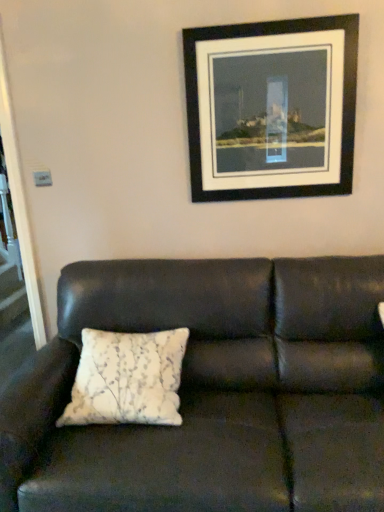
What do you see at coordinates (271, 108) in the screenshot?
I see `black matte picture frame at upper center` at bounding box center [271, 108].

Identify the location of white textured pillow at center. This screenshot has height=512, width=384. (127, 379).

Which object is positioned more to the left, leather couch at center or black matte picture frame at upper center?

leather couch at center.

Measure the distance between leather couch at center and black matte picture frame at upper center.

31.42 inches.

Which point is more forward, (264, 267) or (222, 117)?

The point (264, 267) is closer to the camera.

Is white textured pillow at center in front of black matte picture frame at upper center?

Yes, it is in front of black matte picture frame at upper center.

Is white textured pillow at center next to black matte picture frame at upper center and touching it?

white textured pillow at center is not next to black matte picture frame at upper center, and they're not touching.

Is white textured pillow at center turned away from black matte picture frame at upper center?

No.

Can you confirm if white textured pillow at center is wider than black matte picture frame at upper center?

Correct, the width of white textured pillow at center exceeds that of black matte picture frame at upper center.

Is black matte picture frame at upper center inside the boundaries of white textured pillow at center, or outside?

black matte picture frame at upper center is outside white textured pillow at center.

Which object is closer to the camera, black matte picture frame at upper center or white textured pillow at center?

white textured pillow at center is in front.

There is a white textured pillow at center. Where is `picture frame above it (from a real-world perspective)`? This screenshot has width=384, height=512. picture frame above it (from a real-world perspective) is located at coordinates (271, 108).

From a real-world perspective, is black matte picture frame at upper center located beneath white textured pillow at center?

Incorrect, from a real-world perspective, black matte picture frame at upper center is higher than white textured pillow at center.

In the scene shown: From a real-world perspective, is black matte picture frame at upper center physically located above or below leather couch at center?

From a real-world perspective, black matte picture frame at upper center is physically above leather couch at center.

Is black matte picture frame at upper center facing away from leather couch at center?

No.

How many degrees apart are the facing directions of black matte picture frame at upper center and leather couch at center?

0.485 degrees separate the facing orientations of black matte picture frame at upper center and leather couch at center.

Is white textured pillow at center far from leather couch at center?

No, white textured pillow at center is not far from leather couch at center.

Considering the positions of objects white textured pillow at center and leather couch at center in the image provided, who is more to the left, white textured pillow at center or leather couch at center?

white textured pillow at center.

Who is bigger, white textured pillow at center or leather couch at center?

leather couch at center.

Does white textured pillow at center have a lesser height compared to leather couch at center?

Correct, white textured pillow at center is not as tall as leather couch at center.

Is leather couch at center positioned with its back to white textured pillow at center?

Yes, leather couch at center's orientation is away from white textured pillow at center.

Identify the location of pillow above the leather couch at center (from a real-world perspective). This screenshot has width=384, height=512. (127, 379).

Looking at this image, who is shorter, leather couch at center or white textured pillow at center?

Standing shorter between the two is white textured pillow at center.

Considering the positions of objects leather couch at center and white textured pillow at center in the image provided, who is more to the left, leather couch at center or white textured pillow at center?

From the viewer's perspective, white textured pillow at center appears more on the left side.

Image resolution: width=384 pixels, height=512 pixels. Find the location of `picture frame that appears above the leather couch at center (from the image's perspective)`. picture frame that appears above the leather couch at center (from the image's perspective) is located at coordinates (271, 108).

Locate an element on the screen. pillow on the left of the black matte picture frame at upper center is located at coordinates (127, 379).

Considering their positions, is leather couch at center positioned further to white textured pillow at center than black matte picture frame at upper center?

black matte picture frame at upper center is positioned further to the anchor white textured pillow at center.

From the picture: Which object lies nearer to the anchor point leather couch at center, black matte picture frame at upper center or white textured pillow at center?

white textured pillow at center is positioned closer to the anchor leather couch at center.

Based on their spatial positions, is black matte picture frame at upper center or leather couch at center further from white textured pillow at center?

black matte picture frame at upper center lies further to white textured pillow at center than the other object.

Looking at the image, which one is located closer to leather couch at center, white textured pillow at center or black matte picture frame at upper center?

The object closer to leather couch at center is white textured pillow at center.

Consider the image. From the image, which object appears to be farther from black matte picture frame at upper center, leather couch at center or white textured pillow at center?

The object further to black matte picture frame at upper center is white textured pillow at center.

When comparing their distances from black matte picture frame at upper center, does white textured pillow at center or leather couch at center seem closer?

leather couch at center lies closer to black matte picture frame at upper center than the other object.

I want to click on pillow between black matte picture frame at upper center and leather couch at center in the vertical direction, so click(127, 379).